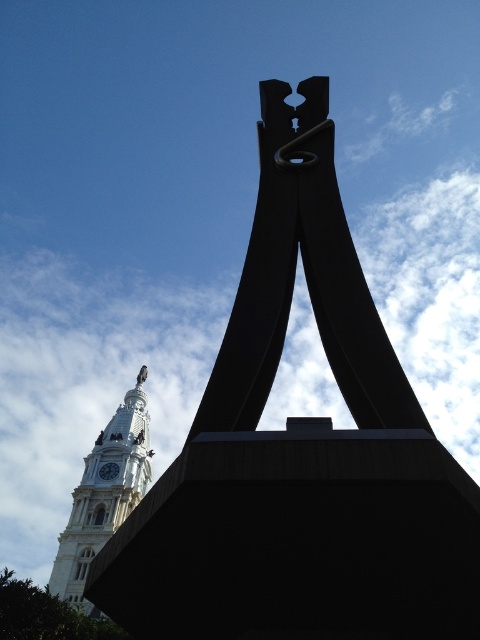
Which is above, black matte sculpture at center or white stone clock tower at lower left?

black matte sculpture at center

Looking at this image, between black matte sculpture at center and white stone clock tower at lower left, which one appears on the left side from the viewer's perspective?

white stone clock tower at lower left

Does point (169, 554) lie behind point (80, 497)?

No.

You are a GUI agent. You are given a task and a screenshot of the screen. Output one action in this format:
    pyautogui.click(x=<x>, y=<y>)
    Task: Click on the black matte sculpture at center
    The height and width of the screenshot is (640, 480).
    Given the screenshot: What is the action you would take?
    pyautogui.click(x=300, y=452)

Who is positioned more to the right, black matte sculpture at center or gold metallic clock at upper left?

black matte sculpture at center is more to the right.

Is point (336, 240) positioned behind point (112, 472)?

No.

Find the location of a particular element. The width and height of the screenshot is (480, 640). black matte sculpture at center is located at coordinates (300, 452).

Who is positioned more to the right, white stone clock tower at lower left or gold metallic clock at upper left?

From the viewer's perspective, gold metallic clock at upper left appears more on the right side.

The image size is (480, 640). Describe the element at coordinates (104, 496) in the screenshot. I see `white stone clock tower at lower left` at that location.

This screenshot has height=640, width=480. What do you see at coordinates (104, 496) in the screenshot? I see `white stone clock tower at lower left` at bounding box center [104, 496].

Image resolution: width=480 pixels, height=640 pixels. Identify the location of white stone clock tower at lower left. (104, 496).